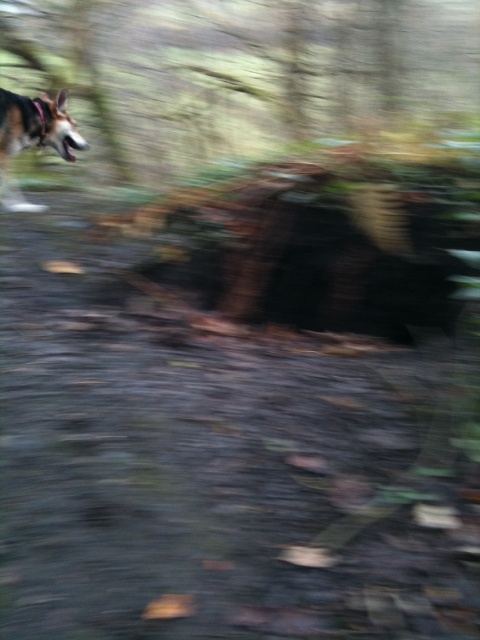
You are a photographer who just took a photo of a dog in a forest. In your image, you notice a brown rough bark at upper left and a brown fur dog at left. Which object is positioned higher in the image?

The brown rough bark at upper left is located above the brown fur dog at left, so it is positioned higher in the image.

You are a photographer analyzing a blurred forest scene. You notice two points in the image at coordinates point (321,88) and point (9,152). Based on the scene, which point is closer to the camera?

Point (321,88) is further to the viewer than point (9,152), so the point closer to the camera is point (9,152).

You are a photographer who just took a picture of a dog in a forest. In your photo, you notice two brown objects at the top left corner. One is the brown rough bark at upper left and the other is the brown fur dog at left. Which of these two objects appears bigger in the photo?

The brown rough bark at upper left appears bigger than the brown fur dog at left in the photo.